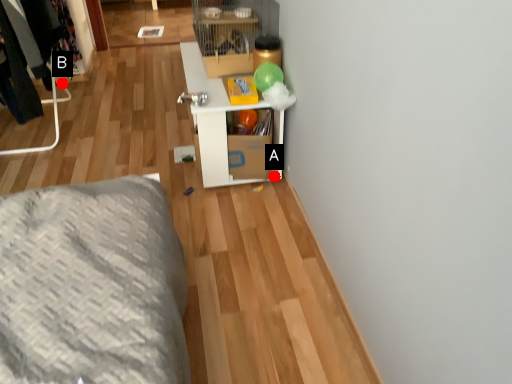
Question: Two points are circled on the image, labeled by A and B beside each circle. Which point is farther to the camera?

Choices:
 (A) A is further
 (B) B is further

Answer: (B)